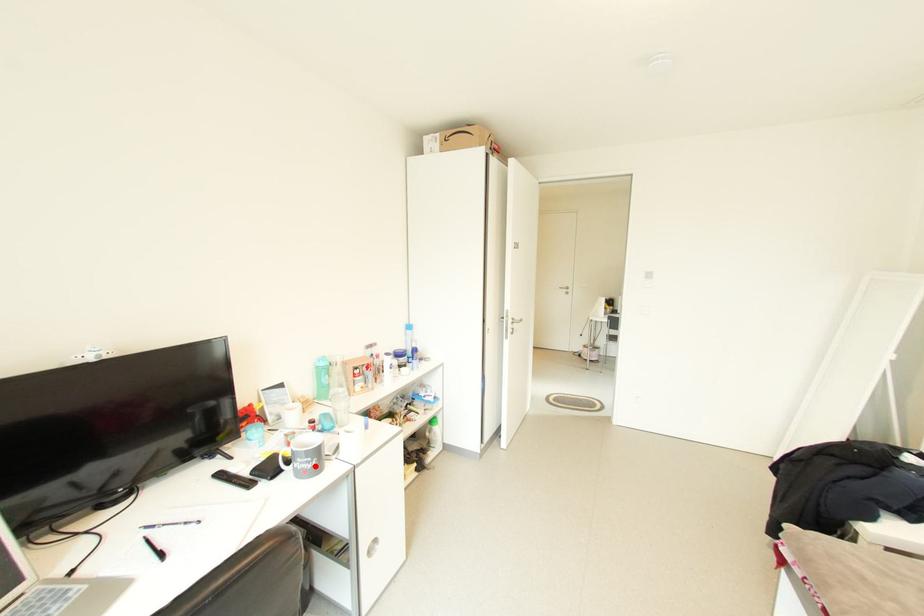
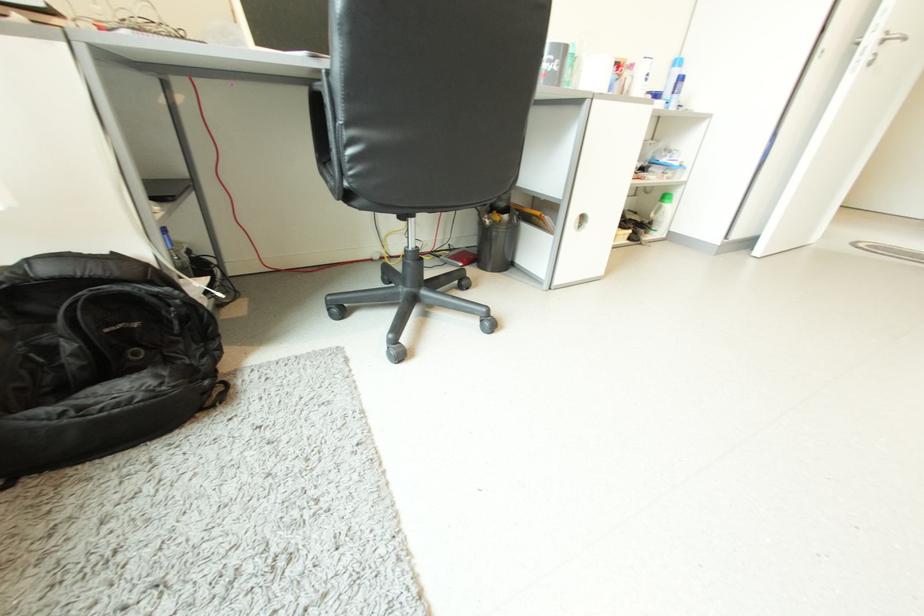
The point at the highlighted location is marked in the first image. Where is the corresponding point in the second image?

(553, 68)